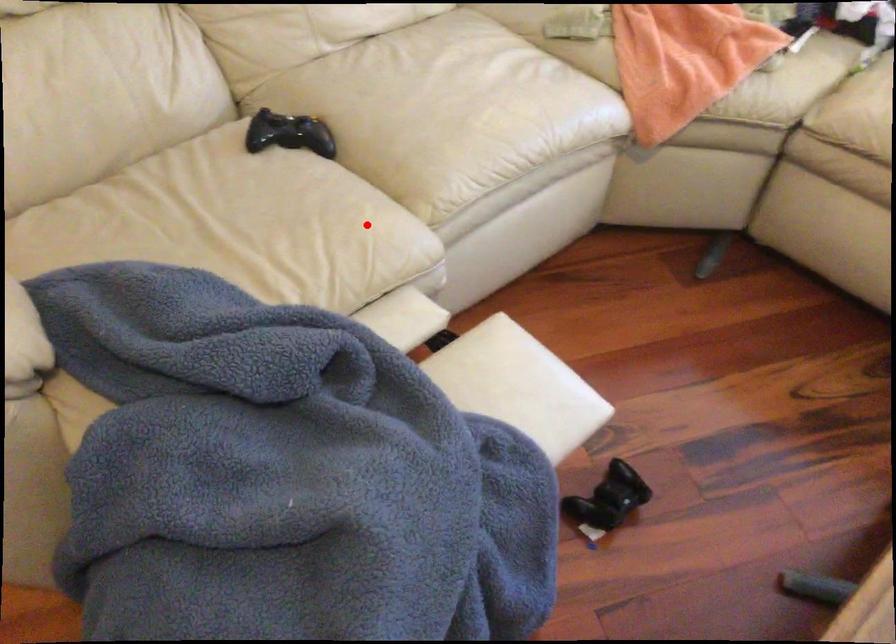
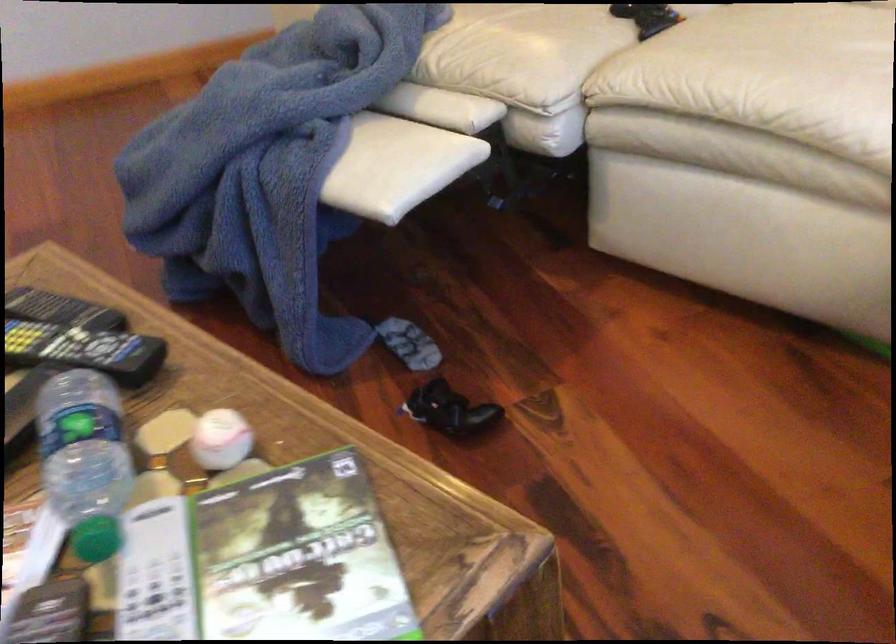
Where in the second image is the point corresponding to the highlighted location from the first image?

(524, 51)